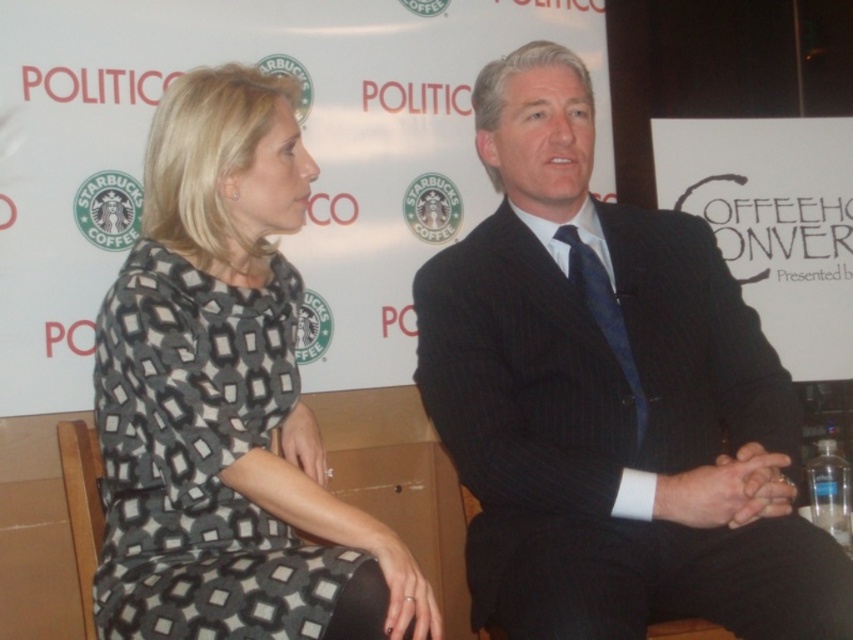
Can you confirm if black pinstripe suit at center is shorter than printed fabric dress at center?

No.

Between black pinstripe suit at center and printed fabric dress at center, which one has less height?

printed fabric dress at center

Where is `black pinstripe suit at center`? This screenshot has width=853, height=640. black pinstripe suit at center is located at coordinates (608, 400).